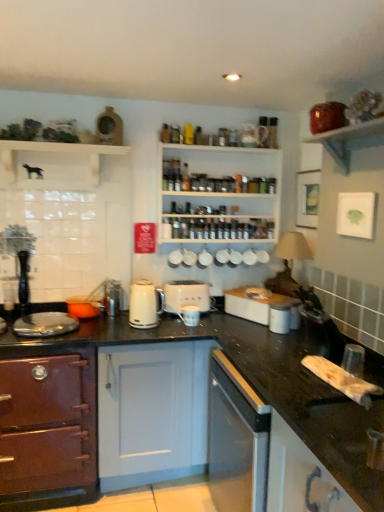
What are the coordinates of `vacant area that is in front of white glossy kettle at center` in the screenshot? It's located at (148, 334).